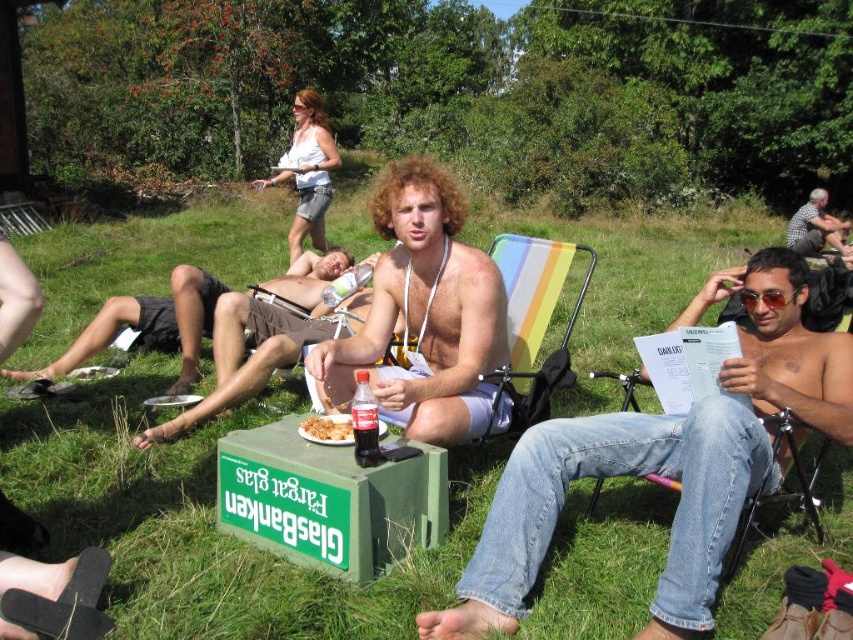
Question: Among these objects, which one is nearest to the camera?

Choices:
 (A) dark red glass bottle at center
 (B) checkered fabric shirt at upper right
 (C) white cotton blouse at upper center
 (D) brown textured shorts at center

Answer: (A)

Question: Which point is closer to the camera taking this photo?

Choices:
 (A) (544, 416)
 (B) (292, 177)
 (C) (643, 248)
 (D) (239, 326)

Answer: (A)

Question: Can you confirm if white cotton blouse at upper center is positioned to the right of brown crumbly food at center?

Choices:
 (A) yes
 (B) no

Answer: (B)

Question: Which of the following is the closest to the observer?

Choices:
 (A) green grass at center
 (B) dark red glass bottle at center
 (C) checkered fabric shirt at upper right
 (D) brown crumbly food at center

Answer: (A)

Question: In this image, where is matte white shorts at center located relative to brown textured shorts at center?

Choices:
 (A) below
 (B) above

Answer: (B)

Question: Where is green grass at center located in relation to shiny silver can at center in the image?

Choices:
 (A) above
 (B) below

Answer: (A)